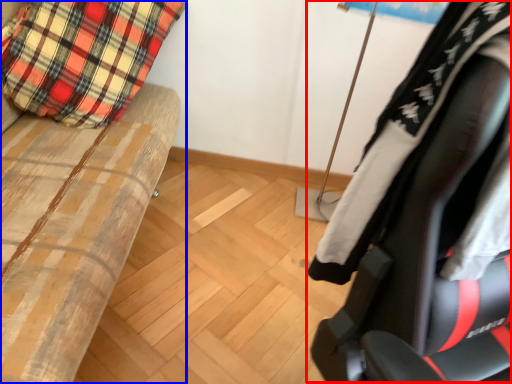
Question: Which object is further to the camera taking this photo, chair (highlighted by a red box) or furniture (highlighted by a blue box)?

Choices:
 (A) chair
 (B) furniture

Answer: (B)